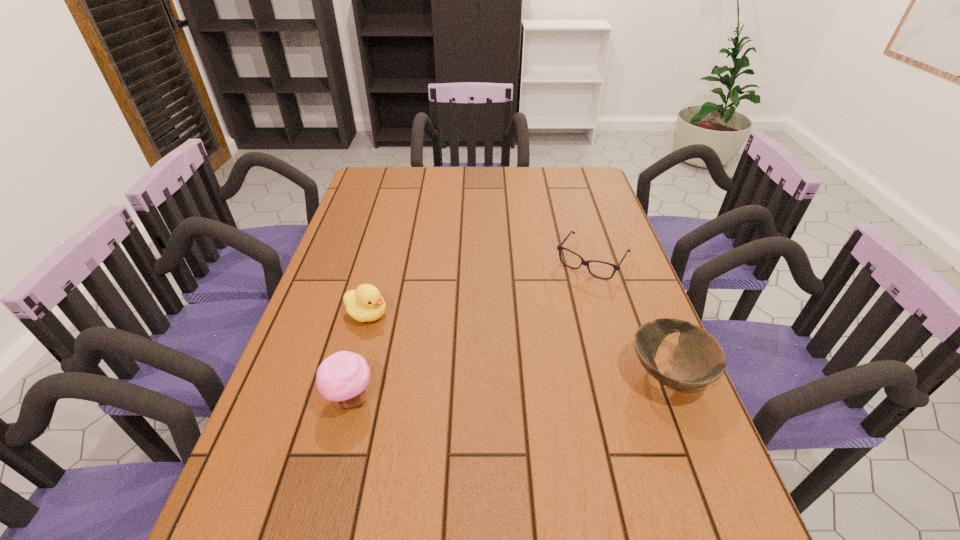
The height and width of the screenshot is (540, 960). I want to click on cupcake, so click(x=342, y=378).

This screenshot has width=960, height=540. I want to click on bowl, so click(699, 360).

Find the location of a particular element. The height and width of the screenshot is (540, 960). the shortest object is located at coordinates (586, 263).

The width and height of the screenshot is (960, 540). In order to click on the farthest object in this screenshot , I will do `click(586, 263)`.

Locate an element on the screen. duckling is located at coordinates pyautogui.click(x=365, y=304).

I want to click on free point located on the right of the cupcake, so click(479, 399).

You are a GUI agent. You are given a task and a screenshot of the screen. Output one action in this format:
    pyautogui.click(x=<x>, y=<y>)
    Task: Click on the vacant space located on the left of the bowl
    
    Given the screenshot: What is the action you would take?
    pyautogui.click(x=550, y=375)

Identify the location of vacant space situated 0.280m on the front-facing side of the spectacles. The image size is (960, 540). (535, 342).

Identify the location of blank space located 0.190m on the front-facing side of the spectacles. (550, 320).

Image resolution: width=960 pixels, height=540 pixels. What are the coordinates of `vacant space located 0.310m on the front-facing side of the spectacles` in the screenshot? It's located at (529, 350).